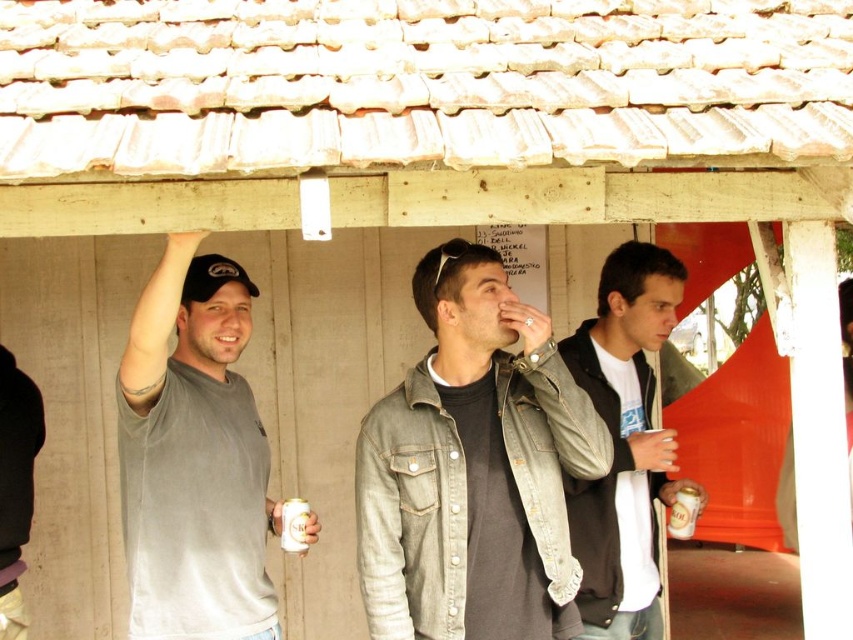
Can you confirm if dark gray hoodie at center is positioned above metallic silver can at center?

Yes.

Who is taller, dark gray hoodie at center or metallic silver can at center?

With more height is dark gray hoodie at center.

Does point (619, 314) come in front of point (282, 516)?

No, it is not.

Locate an element on the screen. This screenshot has width=853, height=640. dark gray hoodie at center is located at coordinates (625, 444).

Is point (144, 408) farther from viewer compared to point (306, 513)?

No.

Based on the photo, can you confirm if gray matte t-shirt at upper left is bigger than metallic silver can at center?

Yes.

Who is more forward, [131,355] or [291,513]?

Point [131,355] is more forward.

The height and width of the screenshot is (640, 853). Identify the location of gray matte t-shirt at upper left. (194, 456).

Based on the photo, which of these two, denim jacket at center or gray matte t-shirt at upper left, stands taller?

With more height is gray matte t-shirt at upper left.

Which of these two, denim jacket at center or gray matte t-shirt at upper left, stands shorter?

denim jacket at center is shorter.

Between point (606, 440) and point (173, 298), which one is positioned in front?

Point (173, 298)

Find the location of a particular element. The image size is (853, 640). denim jacket at center is located at coordinates (473, 468).